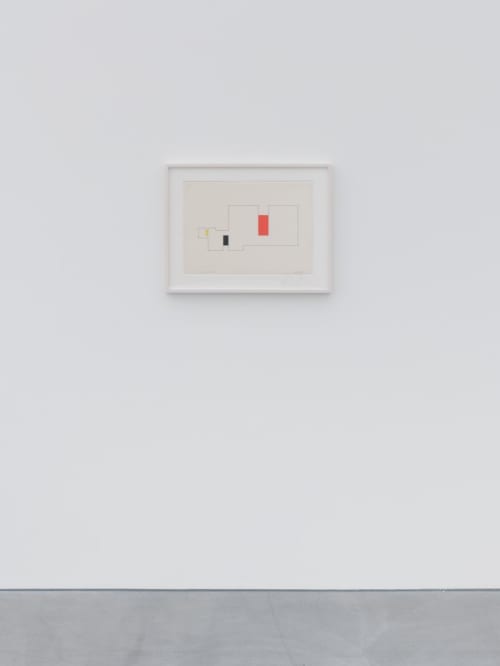
Locate an element on the screen. This screenshot has width=500, height=666. floor is located at coordinates (x=275, y=629).